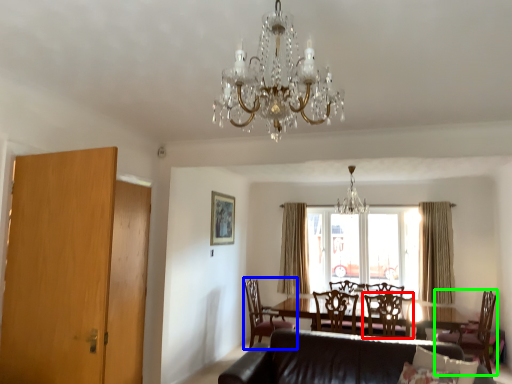
Question: Which object is the closest to the chair (highlighted by a red box)? Choose among these: chair (highlighted by a blue box) or chair (highlighted by a green box).

Choices:
 (A) chair
 (B) chair

Answer: (B)